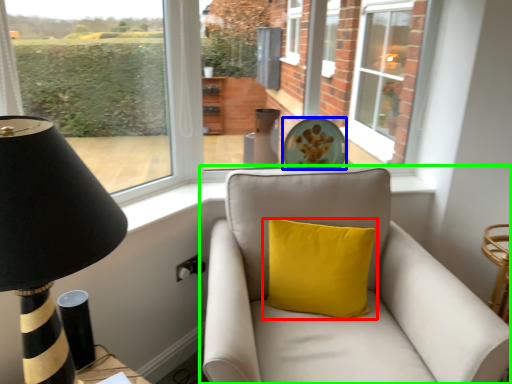
Question: Which is farther away from pillow (highlighted by a red box)? plate (highlighted by a blue box) or studio couch (highlighted by a green box)?

Choices:
 (A) plate
 (B) studio couch

Answer: (A)